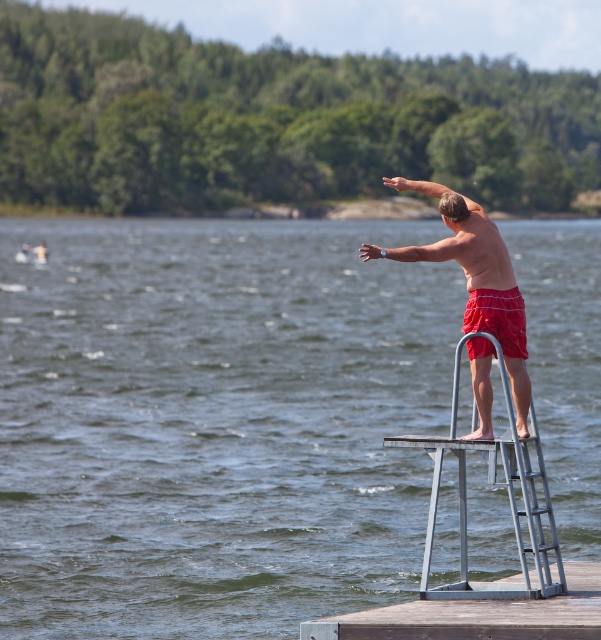
You are standing at the edge of the lake and want to reach the point marked as point (545,564). If you can swim 100 feet in 2 minutes, how long would it take you to swim to that point?

The point (545,564) is 76.56 feet away from the viewer. Since you can swim 100 feet in 2 minutes, swimming 76.56 feet would take approximately 1.53 minutes, which is roughly 1 minute and 32 seconds.

You are a lifeguard on duty at the lakeside. You notice a swimmer in trouble at the clear blue water at center. The diving board is located at point (x=215, y=422). Can you reach the swimmer faster by swimming directly from the diving board or by running along the shore to the nearest boat dock and then using a boat?

The clear blue water at center is located at point (x=215, y=422), which is the same location as the diving board. Therefore, you can reach the swimmer immediately by jumping into the water from the diving board, making it the fastest option.